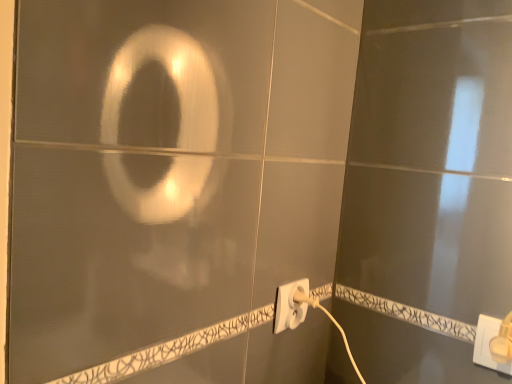
Question: From a real-world perspective, is white plastic power plug at lower right, positioned as the second power plugs and sockets in back-to-front order, beneath white plastic power plug at lower center, the first power plugs and sockets in the left-to-right sequence?

Choices:
 (A) yes
 (B) no

Answer: (A)

Question: Is the position of white plastic power plug at lower right, positioned as the second power plugs and sockets in back-to-front order, less distant than that of white plastic power plug at lower center, positioned as the second power plugs and sockets in right-to-left order?

Choices:
 (A) yes
 (B) no

Answer: (A)

Question: From the image's perspective, is white plastic power plug at lower right, the second power plugs and sockets positioned from the left, over white plastic power plug at lower center, which is the first power plugs and sockets from back to front?

Choices:
 (A) no
 (B) yes

Answer: (A)

Question: Is the surface of white plastic power plug at lower right, the first power plugs and sockets positioned from the front, in direct contact with white plastic power plug at lower center, which is the first power plugs and sockets from back to front?

Choices:
 (A) yes
 (B) no

Answer: (B)

Question: Is white plastic power plug at lower right, positioned as the second power plugs and sockets in back-to-front order, positioned beyond the bounds of white plastic power plug at lower center, the first power plugs and sockets in the left-to-right sequence?

Choices:
 (A) no
 (B) yes

Answer: (B)

Question: From the image's perspective, is white plastic power plug at lower right, positioned as the second power plugs and sockets in back-to-front order, below white plastic power plug at lower center, positioned as the second power plugs and sockets in right-to-left order?

Choices:
 (A) yes
 (B) no

Answer: (A)

Question: Is white plastic power plug at lower center, arranged as the second power plugs and sockets when viewed from the front, oriented away from white plastic power plug at lower right, the second power plugs and sockets positioned from the left?

Choices:
 (A) yes
 (B) no

Answer: (B)

Question: Is white plastic power plug at lower center, the first power plugs and sockets in the left-to-right sequence, to the right of white plastic power plug at lower right, positioned as the second power plugs and sockets in back-to-front order, from the viewer's perspective?

Choices:
 (A) no
 (B) yes

Answer: (A)

Question: Can you confirm if white plastic power plug at lower center, which is the first power plugs and sockets from back to front, is positioned to the left of white plastic power plug at lower right, the second power plugs and sockets positioned from the left?

Choices:
 (A) no
 (B) yes

Answer: (B)

Question: Is the depth of white plastic power plug at lower center, the first power plugs and sockets in the left-to-right sequence, less than that of white plastic power plug at lower right, the second power plugs and sockets positioned from the left?

Choices:
 (A) yes
 (B) no

Answer: (B)

Question: Considering the relative sizes of white plastic power plug at lower center, arranged as the second power plugs and sockets when viewed from the front, and white plastic power plug at lower right, positioned as the second power plugs and sockets in back-to-front order, in the image provided, is white plastic power plug at lower center, arranged as the second power plugs and sockets when viewed from the front, taller than white plastic power plug at lower right, positioned as the second power plugs and sockets in back-to-front order,?

Choices:
 (A) no
 (B) yes

Answer: (B)

Question: Is white plastic power plug at lower center, arranged as the second power plugs and sockets when viewed from the front, located outside white plastic power plug at lower right, acting as the first power plugs and sockets starting from the right?

Choices:
 (A) no
 (B) yes

Answer: (B)

Question: From a real-world perspective, relative to white plastic power plug at lower center, arranged as the second power plugs and sockets when viewed from the front, is white plastic power plug at lower right, acting as the first power plugs and sockets starting from the right, vertically above or below?

Choices:
 (A) above
 (B) below

Answer: (B)